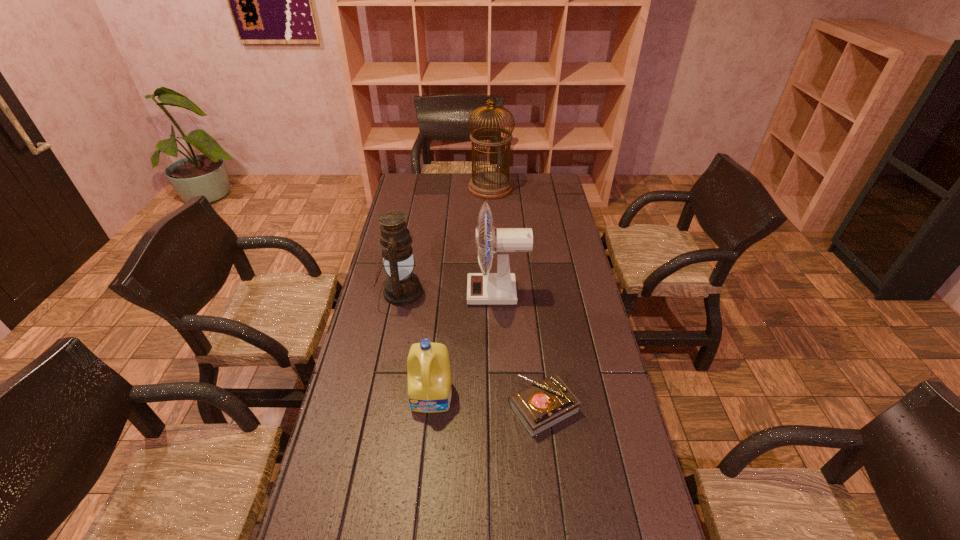
Find the location of `the tallest object`. the tallest object is located at coordinates (487, 185).

This screenshot has height=540, width=960. I want to click on birdcage, so click(x=487, y=185).

Locate an element on the screen. fan is located at coordinates (485, 288).

Where is `oil lamp`? oil lamp is located at coordinates (402, 287).

Find the location of `detergent`. detergent is located at coordinates (429, 378).

At what (x,y) coordinates should I click in order to perform the action: click on the second shortest object. Please return your answer as a coordinate pair (x, y). Looking at the image, I should click on (429, 378).

Locate an element on the screen. Image resolution: width=960 pixels, height=540 pixels. diary is located at coordinates [544, 404].

Where is `vacant space located 0.210m on the front-facing side of the farthest object`? The image size is (960, 540). vacant space located 0.210m on the front-facing side of the farthest object is located at coordinates (425, 188).

Where is `vacant space situated 0.130m on the front-facing side of the farthest object`? Image resolution: width=960 pixels, height=540 pixels. vacant space situated 0.130m on the front-facing side of the farthest object is located at coordinates pos(442,188).

Where is `vacant position located 0.150m on the front-facing side of the farthest object`? vacant position located 0.150m on the front-facing side of the farthest object is located at coordinates (438, 188).